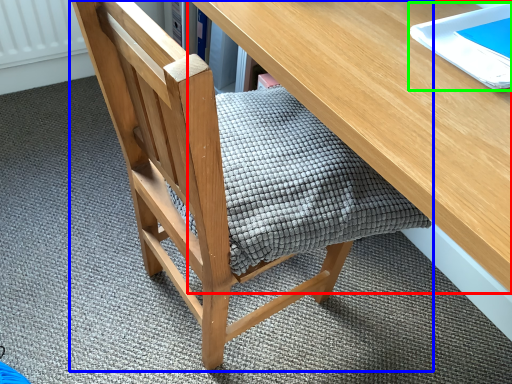
Question: Considering the real-world distances, which object is farthest from desk (highlighted by a red box)? chair (highlighted by a blue box) or notebook (highlighted by a green box)?

Choices:
 (A) chair
 (B) notebook

Answer: (A)